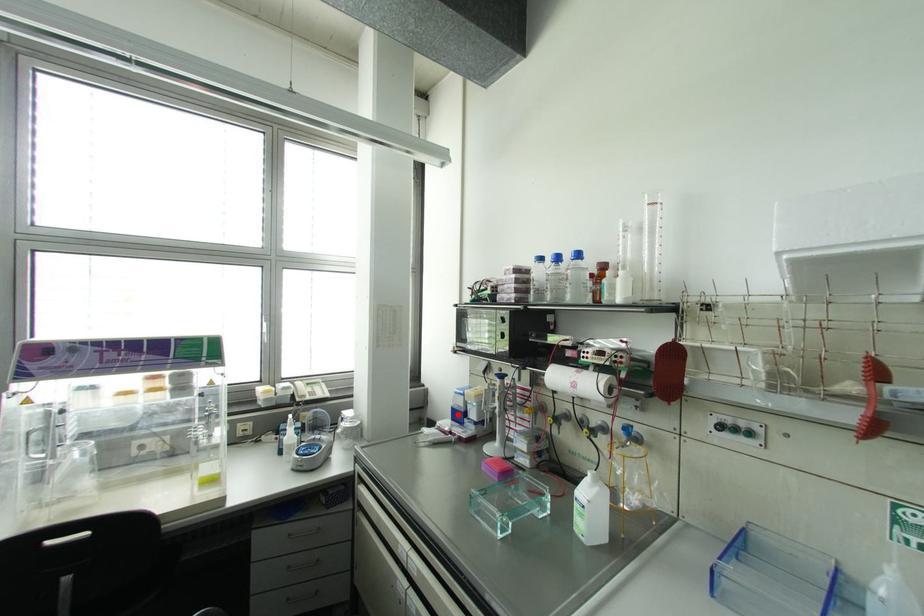
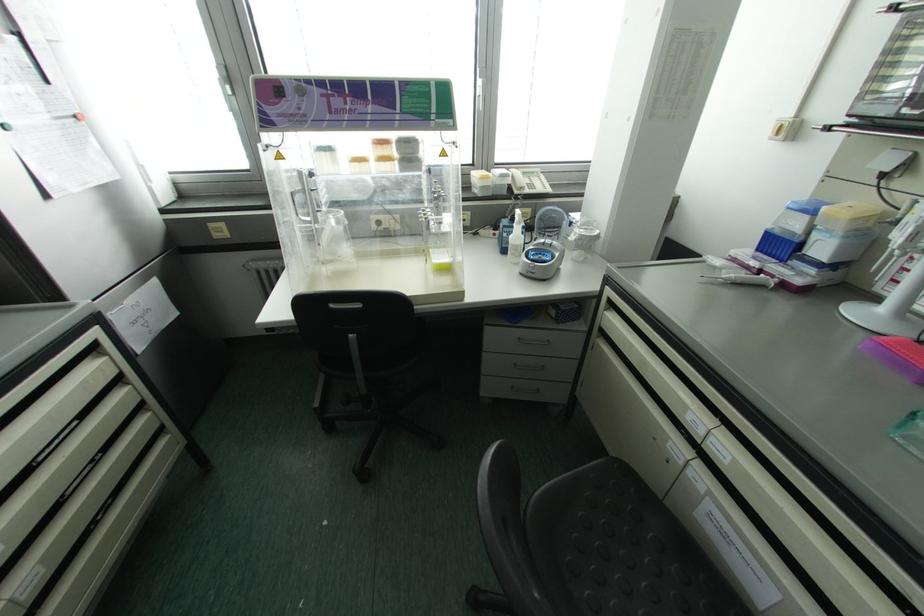
Question: I am providing you with two images of the same scene from different viewpoints. A red point is shown in image1. For the corresponding object point in image2, is it positioned nearer or farther from the camera?

Choices:
 (A) Nearer
 (B) Farther

Answer: (A)